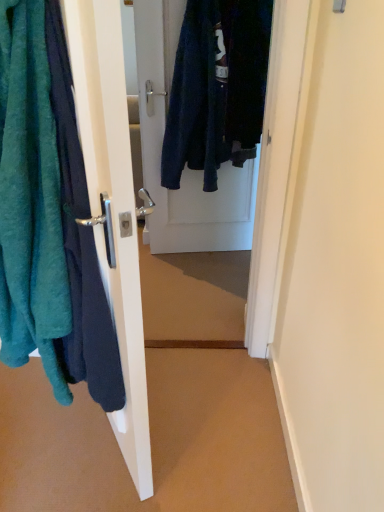
Question: Can you confirm if matte white door handle at left, positioned as the second door in back-to-front order, is wider than teal fuzzy towel at left?

Choices:
 (A) yes
 (B) no

Answer: (B)

Question: Does matte white door handle at left, positioned as the second door in back-to-front order, appear on the right side of teal fuzzy towel at left?

Choices:
 (A) yes
 (B) no

Answer: (A)

Question: Does matte white door handle at left, positioned as the second door in back-to-front order, have a greater height compared to teal fuzzy towel at left?

Choices:
 (A) yes
 (B) no

Answer: (A)

Question: Considering the relative sizes of matte white door handle at left, the first door from the front, and teal fuzzy towel at left in the image provided, is matte white door handle at left, the first door from the front, thinner than teal fuzzy towel at left?

Choices:
 (A) yes
 (B) no

Answer: (A)

Question: Does matte white door handle at left, placed as the second door when sorted from right to left, contain teal fuzzy towel at left?

Choices:
 (A) yes
 (B) no

Answer: (B)

Question: From their relative heights in the image, would you say teal fuzzy towel at left is taller or shorter than velvet dark blue coat at center, which is the first door in back-to-front order?

Choices:
 (A) tall
 (B) short

Answer: (B)

Question: From the image's perspective, relative to velvet dark blue coat at center, which is the first door in back-to-front order, is teal fuzzy towel at left above or below?

Choices:
 (A) below
 (B) above

Answer: (A)

Question: Is point (56, 273) positioned closer to the camera than point (211, 92)?

Choices:
 (A) closer
 (B) farther

Answer: (A)

Question: Is teal fuzzy towel at left wider or thinner than velvet dark blue coat at center, the 2th door when ordered from left to right?

Choices:
 (A) wide
 (B) thin

Answer: (A)

Question: Is matte white door handle at left, positioned as the second door in back-to-front order, to the left or to the right of teal fuzzy towel at left in the image?

Choices:
 (A) left
 (B) right

Answer: (B)

Question: From a real-world perspective, relative to teal fuzzy towel at left, is matte white door handle at left, positioned as the second door in back-to-front order, vertically above or below?

Choices:
 (A) below
 (B) above

Answer: (A)

Question: From their relative heights in the image, would you say matte white door handle at left, the 1th door positioned from the left, is taller or shorter than teal fuzzy towel at left?

Choices:
 (A) tall
 (B) short

Answer: (A)

Question: Considering the positions of matte white door handle at left, placed as the second door when sorted from right to left, and teal fuzzy towel at left in the image, is matte white door handle at left, placed as the second door when sorted from right to left, wider or thinner than teal fuzzy towel at left?

Choices:
 (A) wide
 (B) thin

Answer: (B)

Question: From the image's perspective, relative to matte white door handle at left, the 1th door positioned from the left, is teal fuzzy towel at left above or below?

Choices:
 (A) above
 (B) below

Answer: (A)

Question: Is teal fuzzy towel at left in front of or behind matte white door handle at left, the first door from the front, in the image?

Choices:
 (A) behind
 (B) front

Answer: (B)